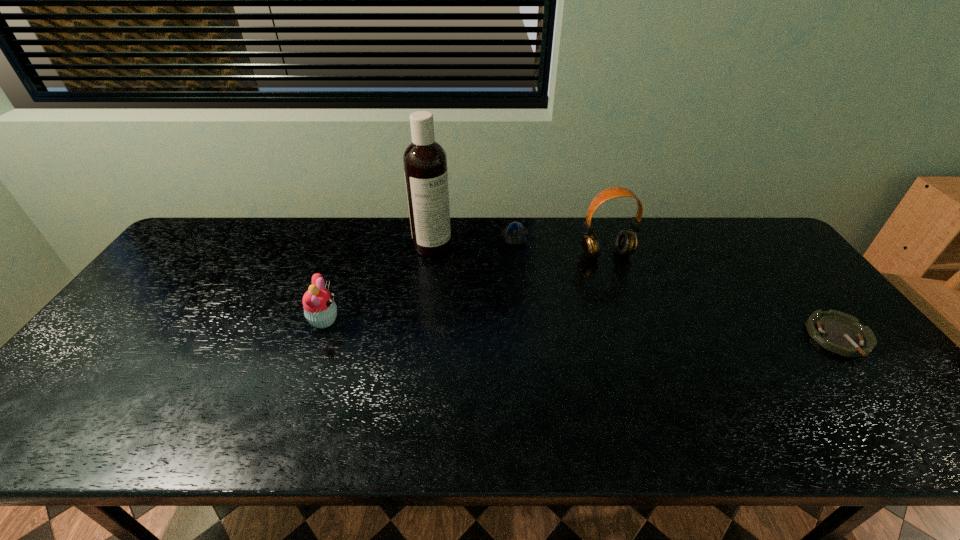
You are a GUI agent. You are given a task and a screenshot of the screen. Output one action in this format:
    pyautogui.click(x=<x>, y=<y>)
    Task: Click on the vacant spot on the desktop that is between the third shortest object and the rightmost object and is positioned on the ear cups of the headset
    The width and height of the screenshot is (960, 540).
    Given the screenshot: What is the action you would take?
    pyautogui.click(x=651, y=331)

Identify the location of free space on the desktop that is between the leftmost object and the ashtray and is positioned on the button side of the second shortest object. coord(504,326).

I want to click on free space on the desktop that is between the third shortest object and the ashtray and is positioned on the label side of the dishwasher detergent, so click(x=566, y=328).